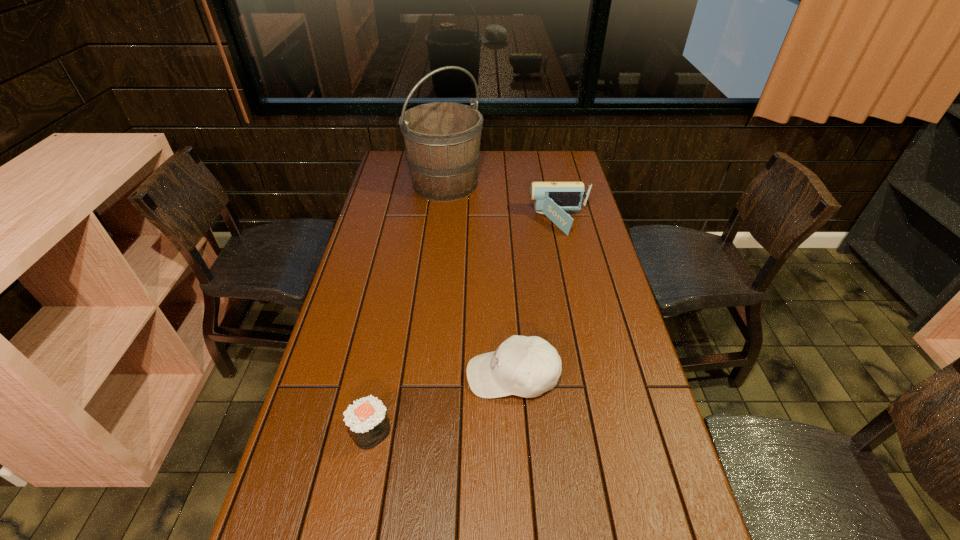
Identify the location of vacant space at the left edge of the desktop. (333, 406).

Where is `vacant position at the far left corner of the desktop`? The height and width of the screenshot is (540, 960). vacant position at the far left corner of the desktop is located at coordinates (400, 178).

This screenshot has width=960, height=540. In the image, there is a desktop. In order to click on free region at the far right corner in this screenshot , I will do `click(540, 162)`.

Find the location of a particular element. free point between the second farthest object and the shortest object is located at coordinates (465, 327).

I want to click on vacant area that lies between the shortest object and the second nearest object, so click(x=442, y=403).

Identify the location of vacant space that's between the shortest object and the tallest object. This screenshot has width=960, height=540. (408, 307).

Image resolution: width=960 pixels, height=540 pixels. I want to click on vacant region between the third farthest object and the second farthest object, so click(x=536, y=299).

Locate an element on the screen. vacant region between the camcorder and the farthest object is located at coordinates (502, 203).

This screenshot has width=960, height=540. Find the location of `vacant region between the third nearest object and the third farthest object`. vacant region between the third nearest object and the third farthest object is located at coordinates (536, 299).

Find the location of a particular element. free spot between the farthest object and the sushi is located at coordinates (408, 307).